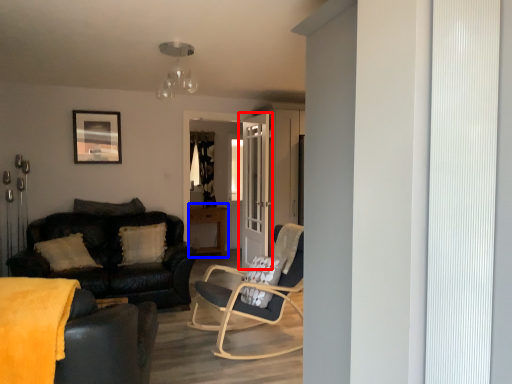
Question: Which object appears farthest to the camera in this image, door (highlighted by a red box) or table (highlighted by a blue box)?

Choices:
 (A) door
 (B) table

Answer: (B)